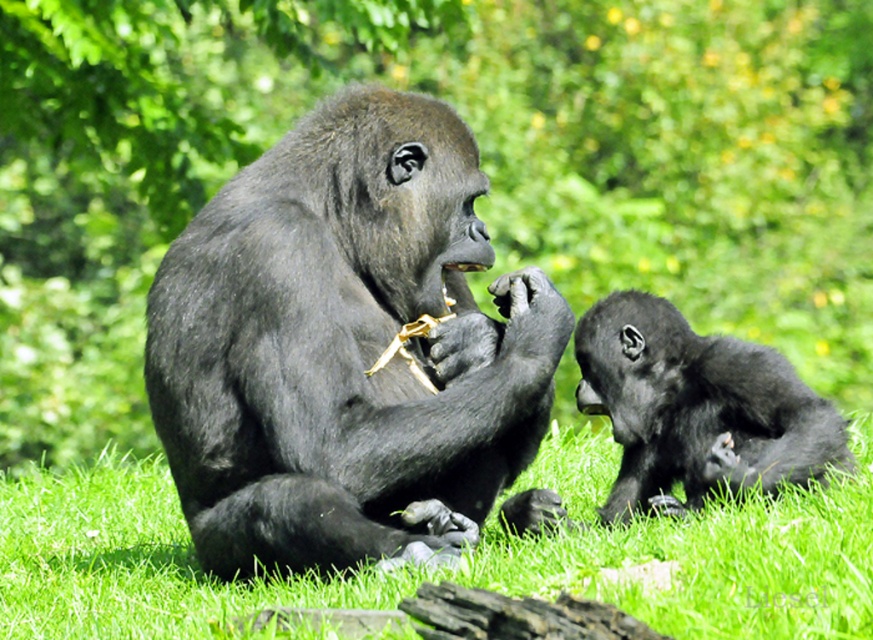
Question: Which of the following is the closest to the observer?

Choices:
 (A) (108, 116)
 (B) (507, 593)

Answer: (B)

Question: Among these objects, which one is farthest from the camera?

Choices:
 (A) green grass at lower center
 (B) shiny black gorilla at center
 (C) green leafy tree at upper center

Answer: (C)

Question: Does green leafy tree at upper center have a greater width compared to green grass at lower center?

Choices:
 (A) no
 (B) yes

Answer: (A)

Question: Is green leafy tree at upper center to the right of green grass at lower center from the viewer's perspective?

Choices:
 (A) yes
 (B) no

Answer: (B)

Question: Considering the real-world distances, which object is closest to the green leafy tree at upper center?

Choices:
 (A) green grass at lower center
 (B) shiny black gorilla at center

Answer: (B)

Question: Does green leafy tree at upper center have a larger size compared to shiny black gorilla at center?

Choices:
 (A) yes
 (B) no

Answer: (B)